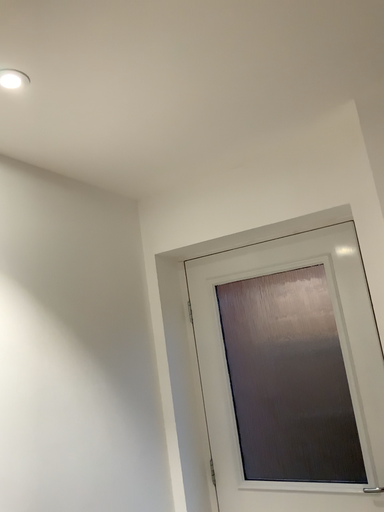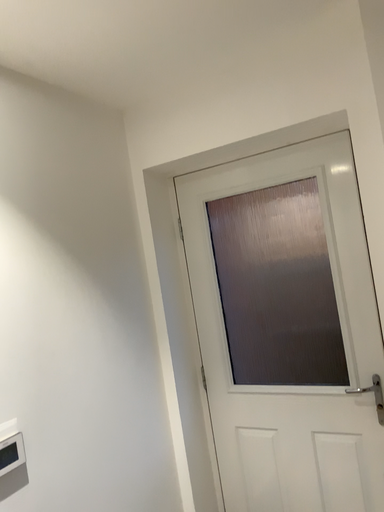
Question: Which way did the camera rotate in the video?

Choices:
 (A) rotated upward
 (B) rotated downward

Answer: (B)